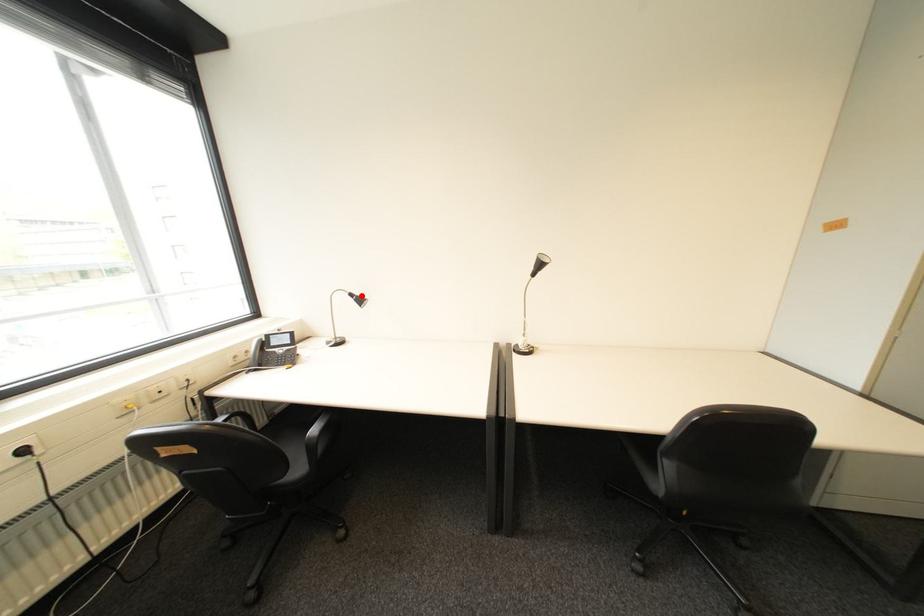
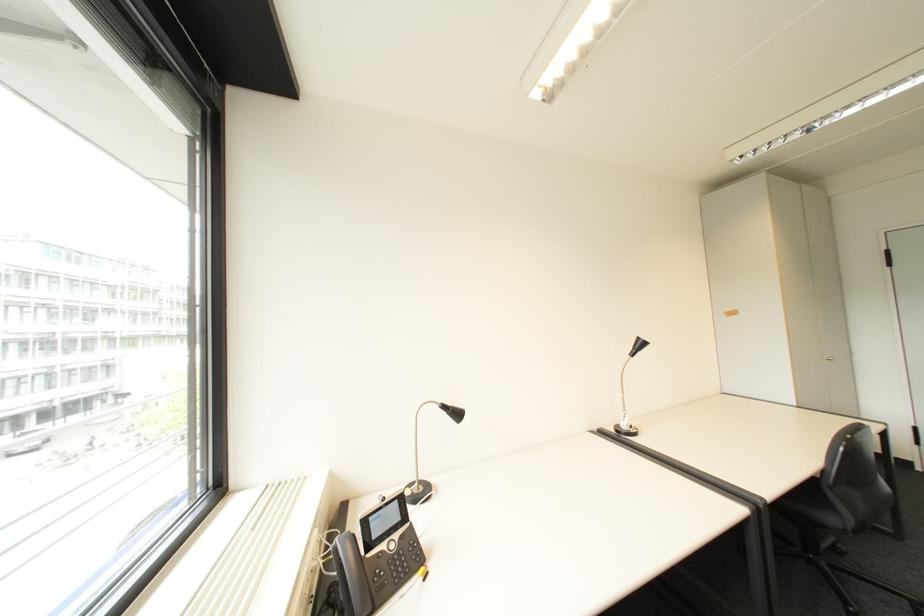
Find the pixel in the second image that matches the highlighted location in the first image.

(455, 407)